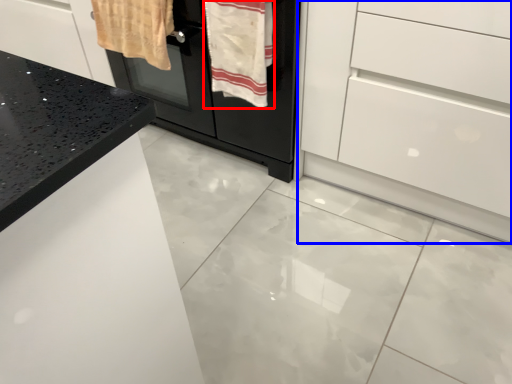
Question: Which object is closer to the camera taking this photo, bath towel (highlighted by a red box) or chest of drawers (highlighted by a blue box)?

Choices:
 (A) bath towel
 (B) chest of drawers

Answer: (B)